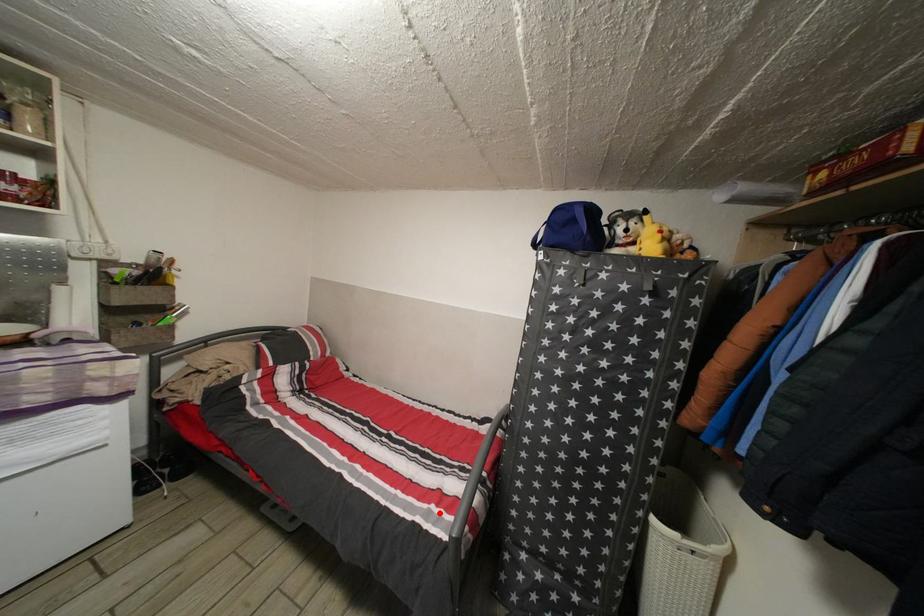
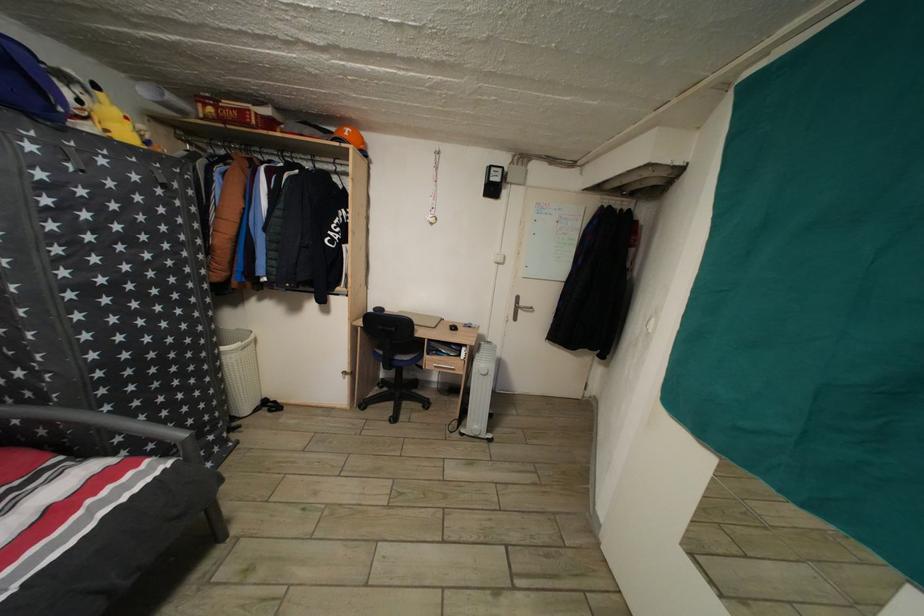
Find the pixel in the second image that matches the highlighted location in the first image.

(96, 508)